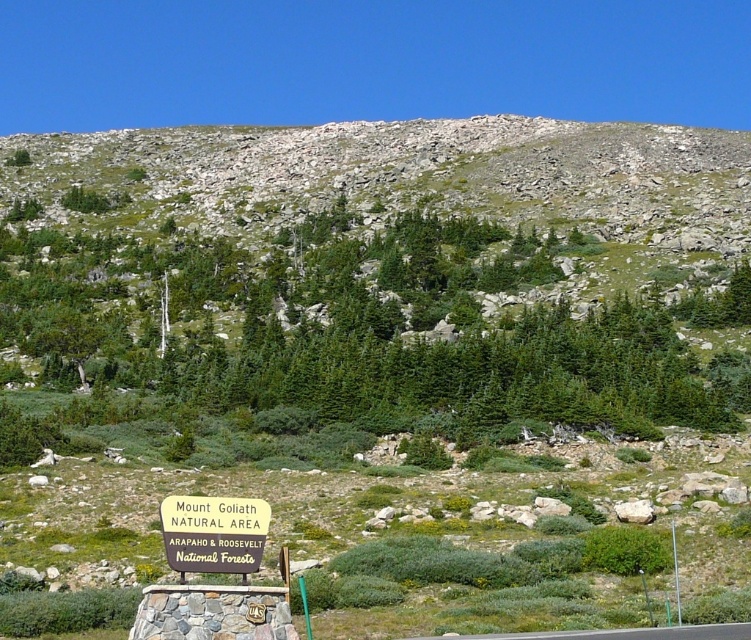
From the picture: You are planning a hiking route and want to know the elevation difference between the green evergreen tree at center and the green grassy hillside at upper center. Which one is higher in elevation?

The green evergreen tree at center is located below the green grassy hillside at upper center, so the green grassy hillside at upper center is higher in elevation.

You are a hiker who wants to take a photo of the yellow wood sign at lower center. To avoid blocking the sign with the green evergreen tree at center, which direction should you move relative to the sign?

The green evergreen tree at center is positioned on the left side of the yellow wood sign at lower center. To avoid blocking the sign, move to the right side of the sign away from the tree.

From the picture: Based on the scene description, where is the green evergreen tree at center located in terms of coordinates?

The green evergreen tree at center is located at point coordinates of [363,332].